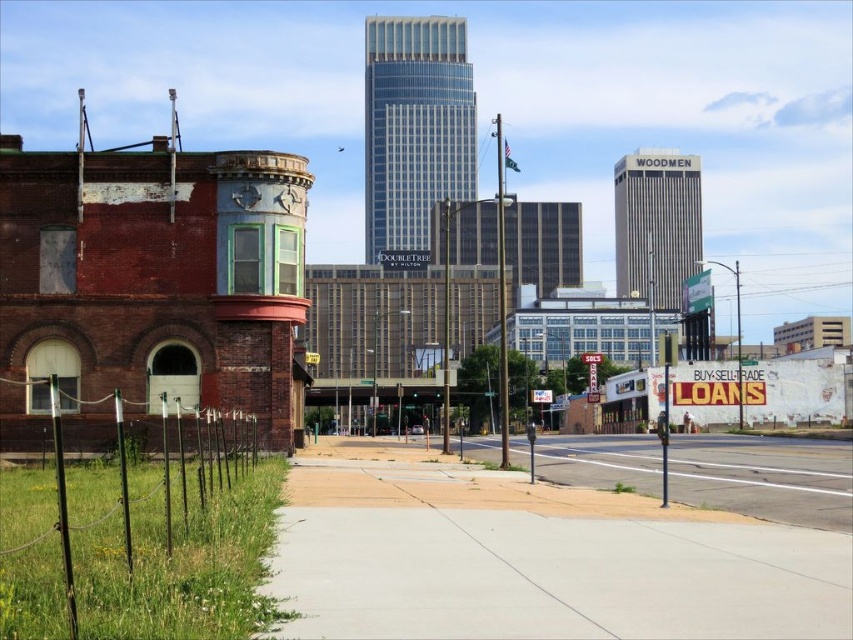
Where is `transparent glass skyscraper at center`? The height and width of the screenshot is (640, 853). transparent glass skyscraper at center is located at coordinates pyautogui.click(x=415, y=128).

Image resolution: width=853 pixels, height=640 pixels. What are the coordinates of `transparent glass skyscraper at center` in the screenshot? It's located at (415, 128).

Where is `transparent glass skyscraper at center`? transparent glass skyscraper at center is located at coordinates (415, 128).

Between gray concrete sidewalk at center and gray concrete skyscraper at center, which one has more height?

gray concrete skyscraper at center

Is point (709, 563) positioned after point (625, 173)?

No, it is in front of (625, 173).

Locate an element on the screen. The image size is (853, 640). gray concrete sidewalk at center is located at coordinates (532, 557).

Is the position of gray concrete sidewalk at center more distant than that of transparent glass skyscraper at center?

No, gray concrete sidewalk at center is in front of transparent glass skyscraper at center.

You are a GUI agent. You are given a task and a screenshot of the screen. Output one action in this format:
    pyautogui.click(x=<x>, y=<y>)
    Task: Click on the gray concrete sidewalk at center
    
    Given the screenshot: What is the action you would take?
    pyautogui.click(x=532, y=557)

Where is `gray concrete sidewalk at center`? Image resolution: width=853 pixels, height=640 pixels. gray concrete sidewalk at center is located at coordinates (532, 557).

Identify the location of gray concrete sidewalk at center. This screenshot has width=853, height=640. (532, 557).